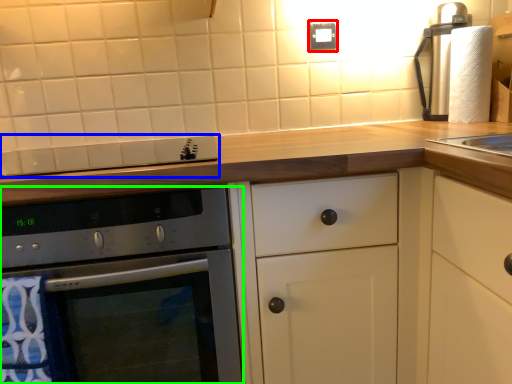
Question: Which object is positioned closest to electric outlet (highlighted by a red box)? Select from gas stove (highlighted by a blue box) and oven (highlighted by a green box).

Choices:
 (A) gas stove
 (B) oven

Answer: (A)